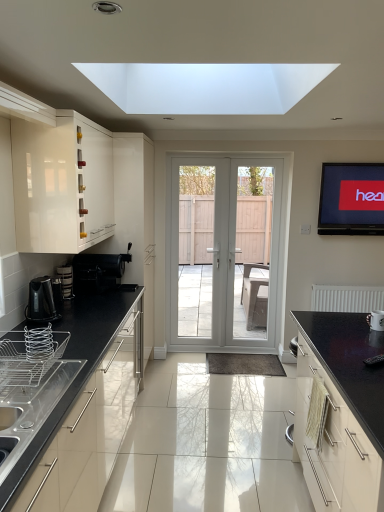
Locate an element on the screen. The height and width of the screenshot is (512, 384). blank space to the left of white glossy mug at lower right, the third appliance viewed from the left is located at coordinates (347, 324).